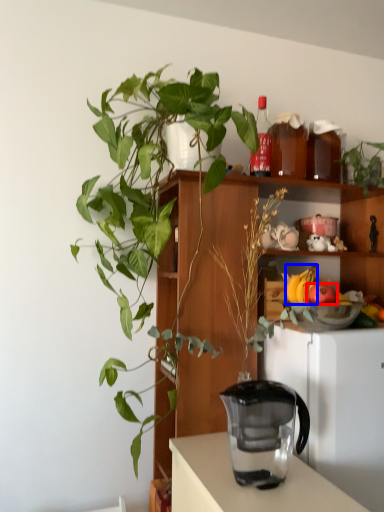
Question: Among these objects, which one is farthest to the camera, apple (highlighted by a red box) or banana (highlighted by a blue box)?

Choices:
 (A) apple
 (B) banana

Answer: (B)